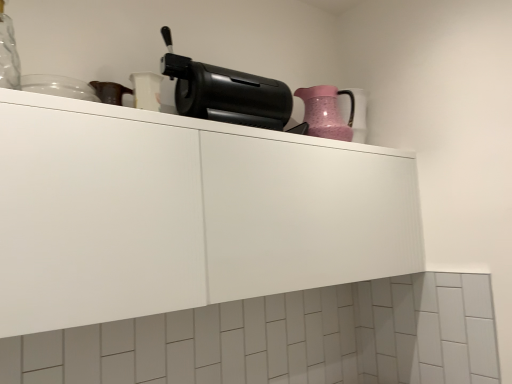
Question: Based on their sizes in the image, would you say white matte cabinet at upper center is bigger or smaller than black plastic coffee maker at upper center?

Choices:
 (A) big
 (B) small

Answer: (A)

Question: Considering the positions of white matte cabinet at upper center and black plastic coffee maker at upper center in the image, is white matte cabinet at upper center taller or shorter than black plastic coffee maker at upper center?

Choices:
 (A) tall
 (B) short

Answer: (A)

Question: Which object is positioned farthest from the black plastic coffee maker at upper center?

Choices:
 (A) white matte cabinet at upper center
 (B) pink textured pitcher at upper right

Answer: (A)

Question: Estimate the real-world distances between objects in this image. Which object is closer to the black plastic coffee maker at upper center?

Choices:
 (A) white matte cabinet at upper center
 (B) pink textured pitcher at upper right

Answer: (B)